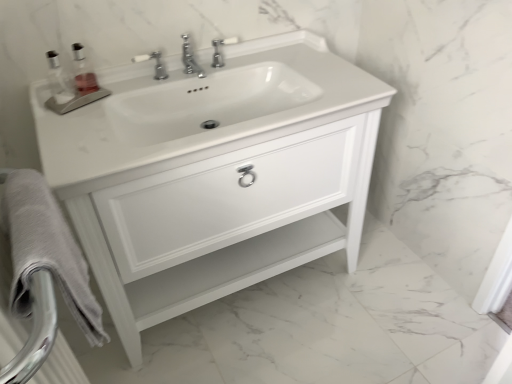
Question: Based on their positions, is clear glass soap dispenser at upper left located to the left or right of white glossy sink at center?

Choices:
 (A) right
 (B) left

Answer: (B)

Question: Is clear glass soap dispenser at upper left in front of or behind white glossy sink at center in the image?

Choices:
 (A) front
 (B) behind

Answer: (B)

Question: Which of these objects is positioned closest to the chrome metallic faucet at center?

Choices:
 (A) white glossy cabinet at center
 (B) clear glass soap dispenser at upper left
 (C) white glossy sink at center
 (D) gray cotton bath towel at lower left

Answer: (B)

Question: Estimate the real-world distances between objects in this image. Which object is farther from the white glossy cabinet at center?

Choices:
 (A) gray cotton bath towel at lower left
 (B) chrome metallic faucet at center
 (C) clear glass soap dispenser at upper left
 (D) white glossy sink at center

Answer: (C)